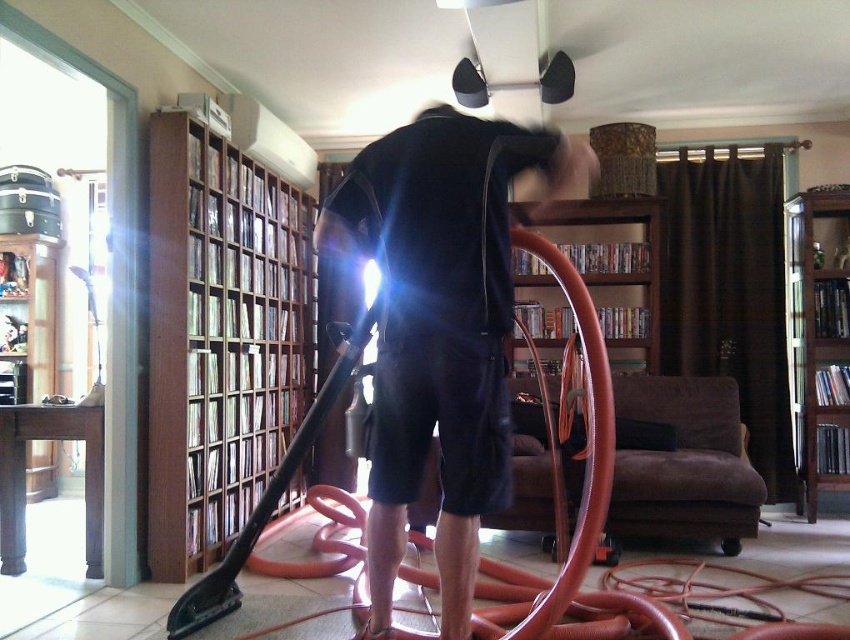
Does brown wooden bookshelf at left appear on the right side of wooden bookshelf at left?

Yes, brown wooden bookshelf at left is to the right of wooden bookshelf at left.

Looking at this image, does brown wooden bookshelf at left have a lesser width compared to wooden bookshelf at left?

Incorrect, brown wooden bookshelf at left's width is not less than wooden bookshelf at left's.

The width and height of the screenshot is (850, 640). Identify the location of brown wooden bookshelf at left. 219,339.

Can you confirm if dark blue fabric shirt at center is positioned below brown wooden bookshelf at left?

Yes, dark blue fabric shirt at center is below brown wooden bookshelf at left.

Can you confirm if dark blue fabric shirt at center is positioned above brown wooden bookshelf at left?

Actually, dark blue fabric shirt at center is below brown wooden bookshelf at left.

Is point (496, 358) in front of point (190, 141)?

That is True.

Identify the location of dark blue fabric shirt at center. This screenshot has width=850, height=640. (439, 332).

Who is more distant from viewer, (391, 412) or (802, 228)?

Positioned behind is point (802, 228).

Is dark blue fabric shirt at center above brown wooden bookshelf at right?

Correct, dark blue fabric shirt at center is located above brown wooden bookshelf at right.

Find the location of `dark blue fabric shirt at center`. dark blue fabric shirt at center is located at coordinates (439, 332).

Image resolution: width=850 pixels, height=640 pixels. Identify the location of dark blue fabric shirt at center. (439, 332).